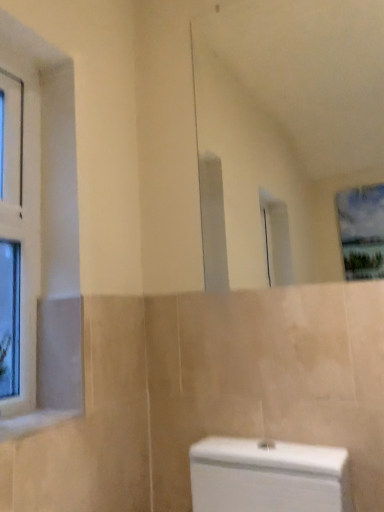
Question: Does clear glass window at left appear on the right side of white marble window sill at lower left?

Choices:
 (A) yes
 (B) no

Answer: (B)

Question: Is white marble window sill at lower left located within clear glass window at left?

Choices:
 (A) no
 (B) yes

Answer: (A)

Question: Is clear glass window at left placed right next to white marble window sill at lower left?

Choices:
 (A) no
 (B) yes

Answer: (A)

Question: From a real-world perspective, is clear glass window at left on white marble window sill at lower left?

Choices:
 (A) no
 (B) yes

Answer: (B)

Question: Does clear glass window at left have a greater height compared to white marble window sill at lower left?

Choices:
 (A) no
 (B) yes

Answer: (B)

Question: Does clear glass window at left come behind white marble window sill at lower left?

Choices:
 (A) yes
 (B) no

Answer: (A)

Question: Is white marble window sill at lower left further to the viewer compared to clear glass window at left?

Choices:
 (A) yes
 (B) no

Answer: (B)

Question: Considering the relative sizes of white marble window sill at lower left and clear glass window at left in the image provided, is white marble window sill at lower left bigger than clear glass window at left?

Choices:
 (A) yes
 (B) no

Answer: (B)

Question: Are white marble window sill at lower left and clear glass window at left far apart?

Choices:
 (A) yes
 (B) no

Answer: (B)

Question: From a real-world perspective, is white marble window sill at lower left on top of clear glass window at left?

Choices:
 (A) yes
 (B) no

Answer: (B)

Question: Is white marble window sill at lower left wider than clear glass window at left?

Choices:
 (A) yes
 (B) no

Answer: (A)

Question: Considering the relative positions of white marble window sill at lower left and clear glass window at left in the image provided, is white marble window sill at lower left to the left of clear glass window at left from the viewer's perspective?

Choices:
 (A) yes
 (B) no

Answer: (B)

Question: Is white glossy mirror at upper center outside clear glass window at left?

Choices:
 (A) yes
 (B) no

Answer: (A)